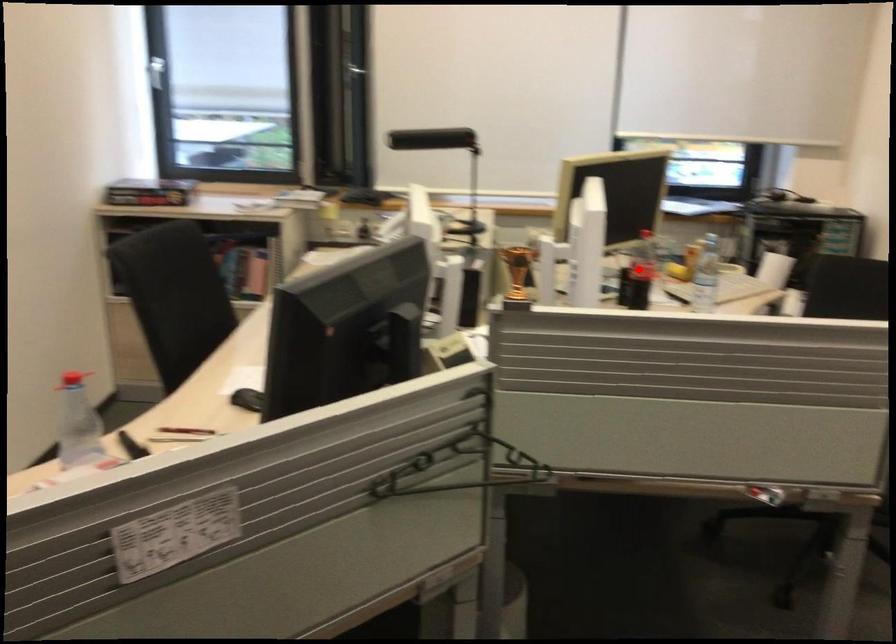
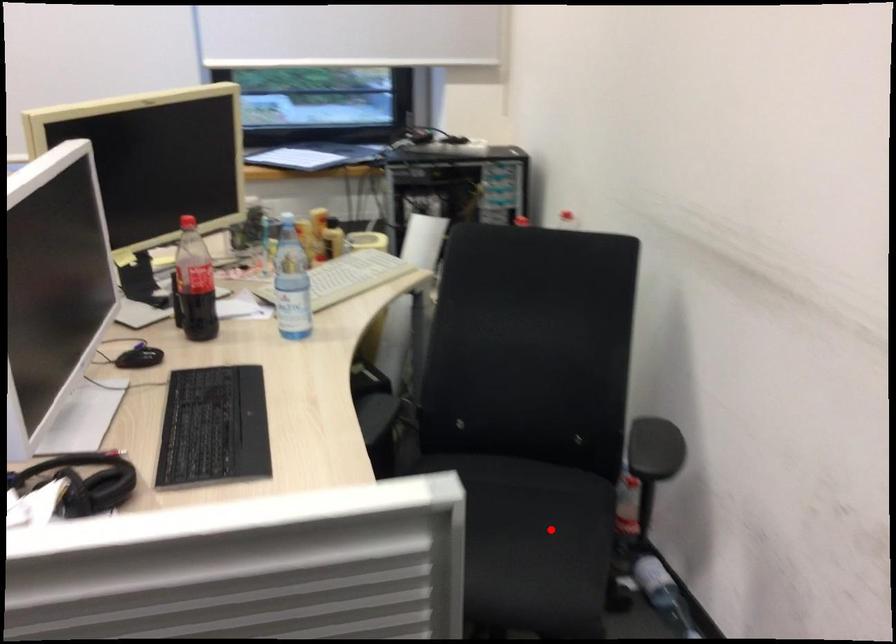
I am providing you with two images of the same scene from different viewpoints. A red point is marked on the first image and another point is marked on the second image. Is the red point in image1 aligned with the point shown in image2?

No